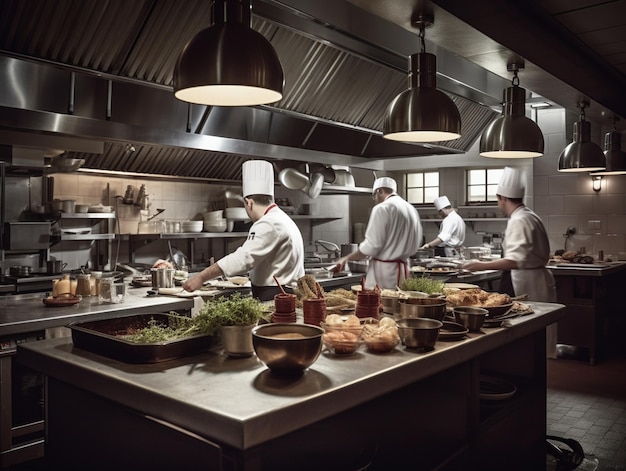
Where is `floor`? The width and height of the screenshot is (626, 471). floor is located at coordinates (575, 414).